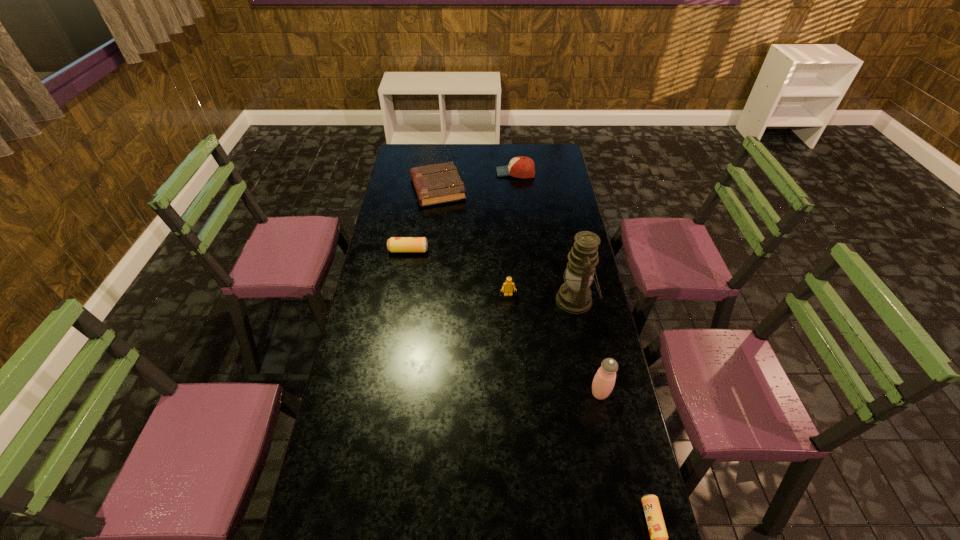
The height and width of the screenshot is (540, 960). Find the location of `the left beer can`. the left beer can is located at coordinates (395, 244).

Find the location of a particular element. the third farthest object is located at coordinates (395, 244).

The height and width of the screenshot is (540, 960). What are the coordinates of `hardback book` in the screenshot? It's located at (439, 183).

You are a GUI agent. You are given a task and a screenshot of the screen. Output one action in this format:
    pyautogui.click(x=<x>, y=<y>)
    Task: Click on the baseball cap
    
    Given the screenshot: What is the action you would take?
    pyautogui.click(x=520, y=167)

The height and width of the screenshot is (540, 960). Identify the location of the sixth shortest object. (603, 383).

Where is `the second nearest object`? the second nearest object is located at coordinates (603, 383).

At what (x,y) coordinates should I click in order to perform the action: click on oil lamp. Please return your answer as a coordinate pair (x, y). Looking at the image, I should click on (574, 296).

Find the location of a particular element. The height and width of the screenshot is (540, 960). Lego is located at coordinates (508, 286).

This screenshot has height=540, width=960. I want to click on free space located 0.230m on the back of the farther beer can, so coord(415,213).

At what (x,y) coordinates should I click in order to perform the action: click on blank space located on the left of the hardback book. Please return your answer as a coordinate pair (x, y). Looking at the image, I should click on (391, 188).